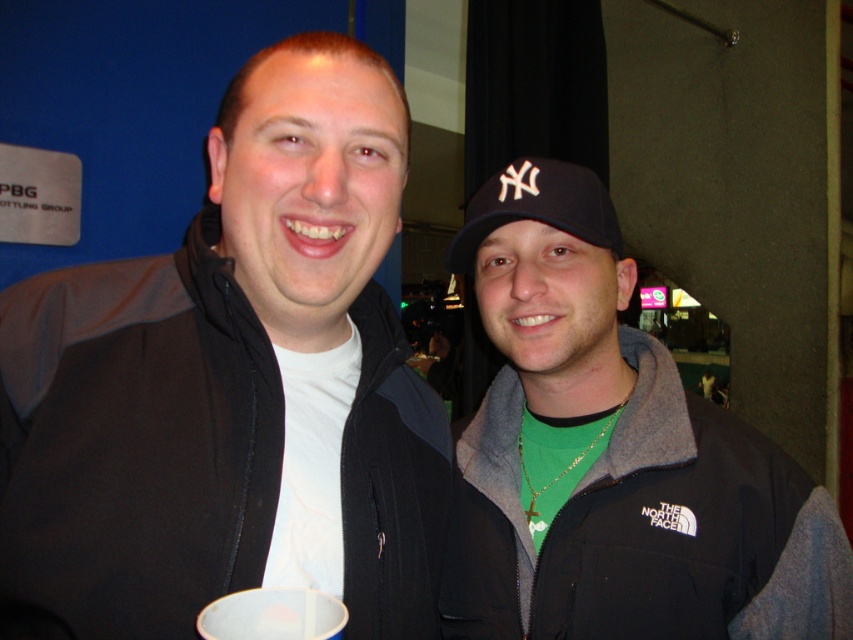
Question: Considering the real-world distances, which object is farthest from the black fleece jacket at right?

Choices:
 (A) black matte jacket at center
 (B) white plastic cup at center
 (C) black fabric baseball cap at center

Answer: (B)

Question: Is black fabric baseball cap at center thinner than white plastic cup at center?

Choices:
 (A) no
 (B) yes

Answer: (A)

Question: Among these objects, which one is nearest to the camera?

Choices:
 (A) black matte jacket at center
 (B) black fleece jacket at right

Answer: (A)

Question: Can you confirm if black matte jacket at center is wider than white plastic cup at center?

Choices:
 (A) yes
 (B) no

Answer: (A)

Question: Among these objects, which one is nearest to the camera?

Choices:
 (A) black fabric baseball cap at center
 (B) black fleece jacket at right

Answer: (B)

Question: Does black fleece jacket at right have a larger size compared to white plastic cup at center?

Choices:
 (A) yes
 (B) no

Answer: (A)